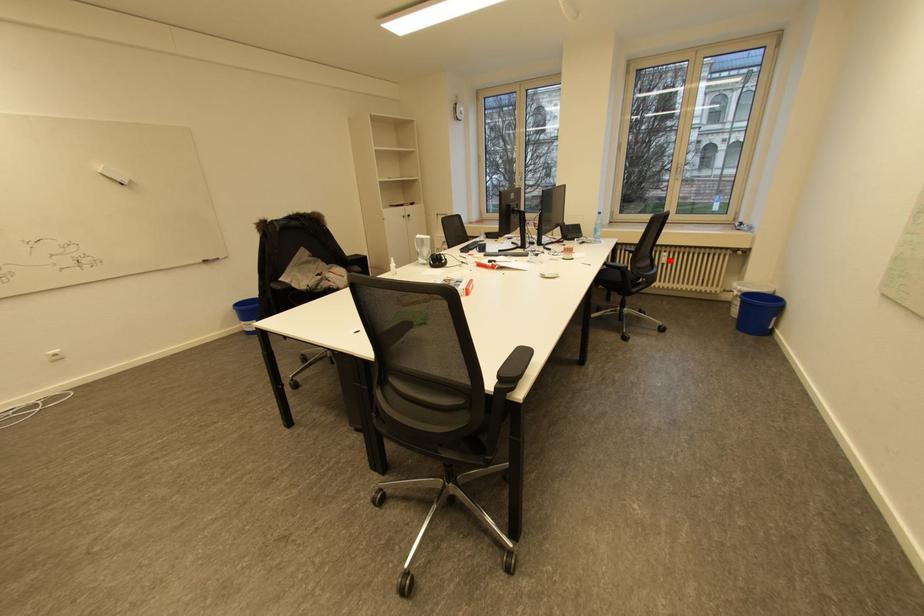
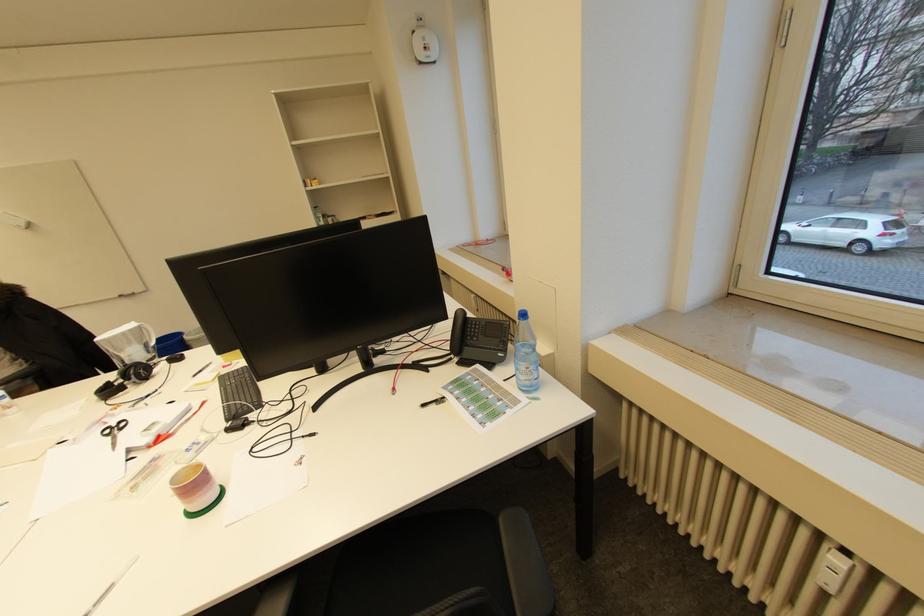
In the second image, find the point that corresponds to the highlighted location in the first image.

(833, 580)